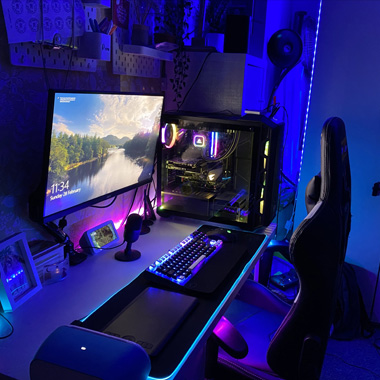
Locate an element on the screen. The image size is (380, 380). small green planter is located at coordinates (140, 35).